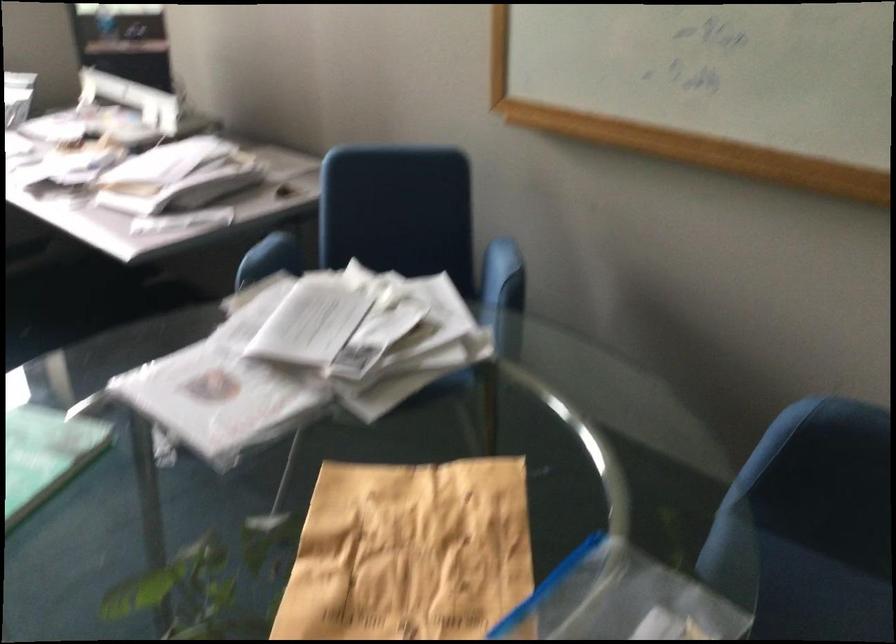
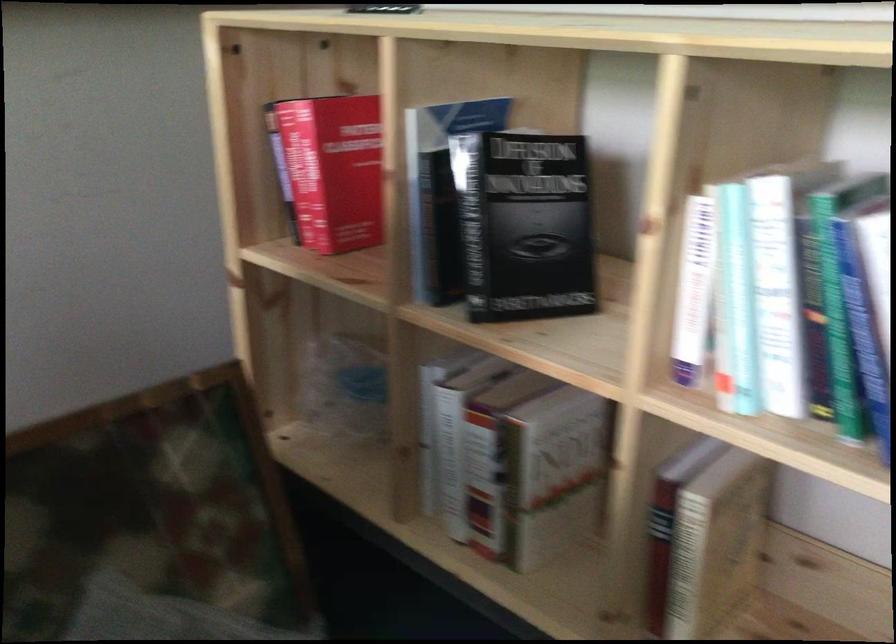
The images are taken continuously from a first-person perspective. In which direction is your viewpoint rotating?

The camera's rotation is toward right-down.